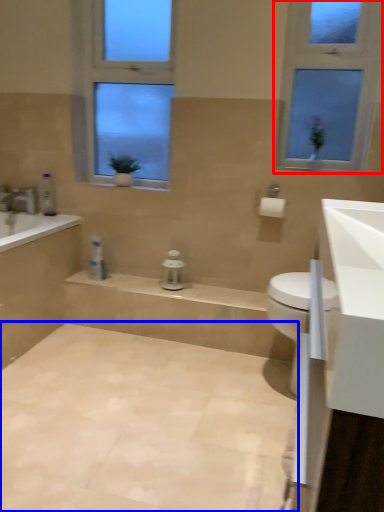
Question: Which point is closer to the camera, window (highlighted by a red box) or plain (highlighted by a blue box)?

Choices:
 (A) window
 (B) plain

Answer: (B)